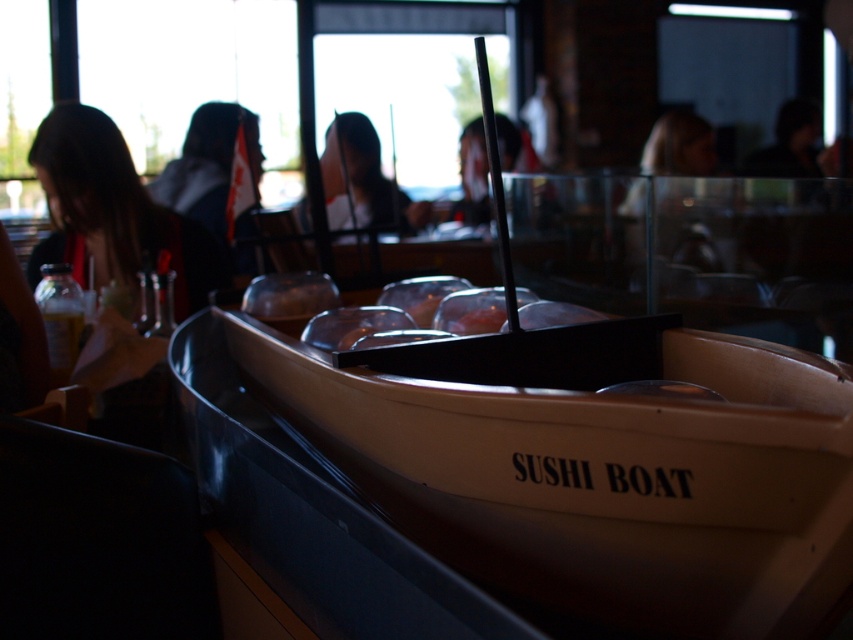
You are a customer at a sushi boat restaurant and want to grab the black stick from the sushi boat. The black stick is located at point (x=302, y=426). If you can reach up to 30 inches, can you reach it?

The black stick is located at point (x=302, y=426) and they are 32.66 inches apart, so you cannot reach it since your maximum reach is 30 inches.

You are a customer at a sushi restaurant and see the wooden sushi boat at center and the smooth black hair at center. Which object is nearer to you?

The wooden sushi boat at center is closer to the viewer than the smooth black hair at center.

You are a customer sitting at a table in the sushi boat restaurant. You notice two points marked on the sushi boat. The first point is at coordinate point (x=759, y=561) and the second is at point (x=502, y=140). Which point is closer to you?

Point (x=759, y=561) is closer to the viewer than point (x=502, y=140).